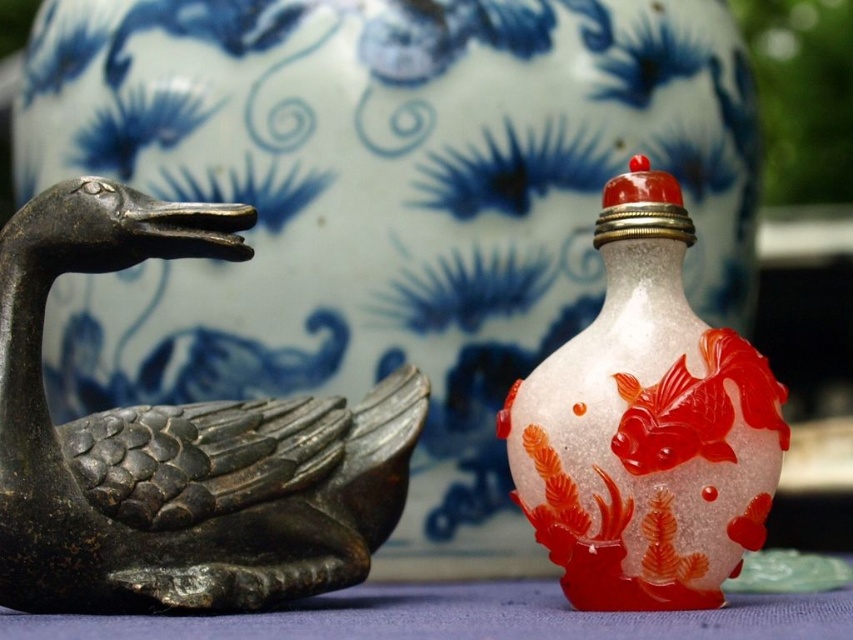
Does black matte goose at left lie in front of translucent glass snuff bottle at center?

Yes, it is.

Between black matte goose at left and translucent glass snuff bottle at center, which one has less height?

black matte goose at left is shorter.

Is point (149, 512) positioned in front of point (517, 444)?

Yes, it is in front of point (517, 444).

You are a GUI agent. You are given a task and a screenshot of the screen. Output one action in this format:
    pyautogui.click(x=<x>, y=<y>)
    Task: Click on the black matte goose at left
    The image size is (853, 640).
    Given the screenshot: What is the action you would take?
    pyautogui.click(x=177, y=445)